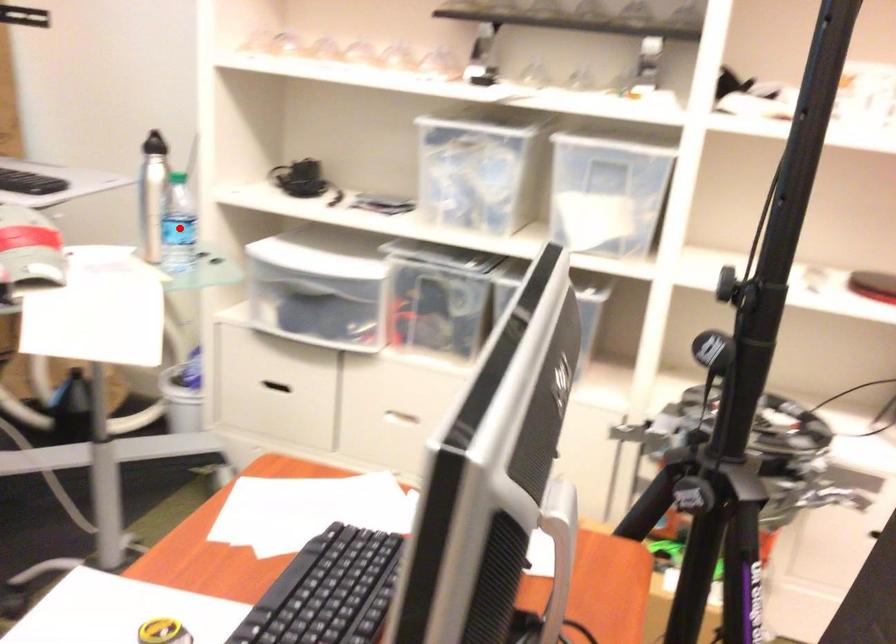
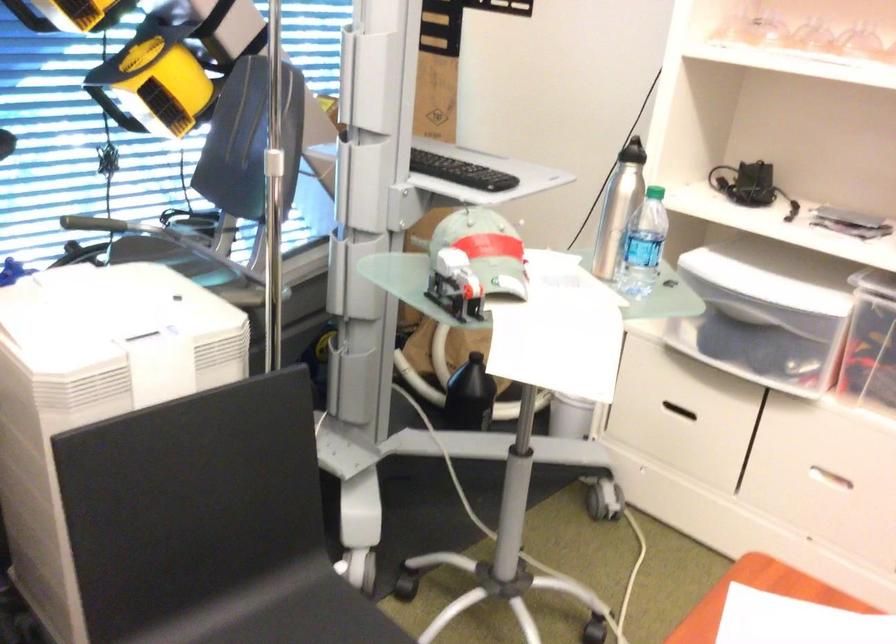
Where in the second image is the point corresponding to the highlighted location from the first image?

(643, 245)